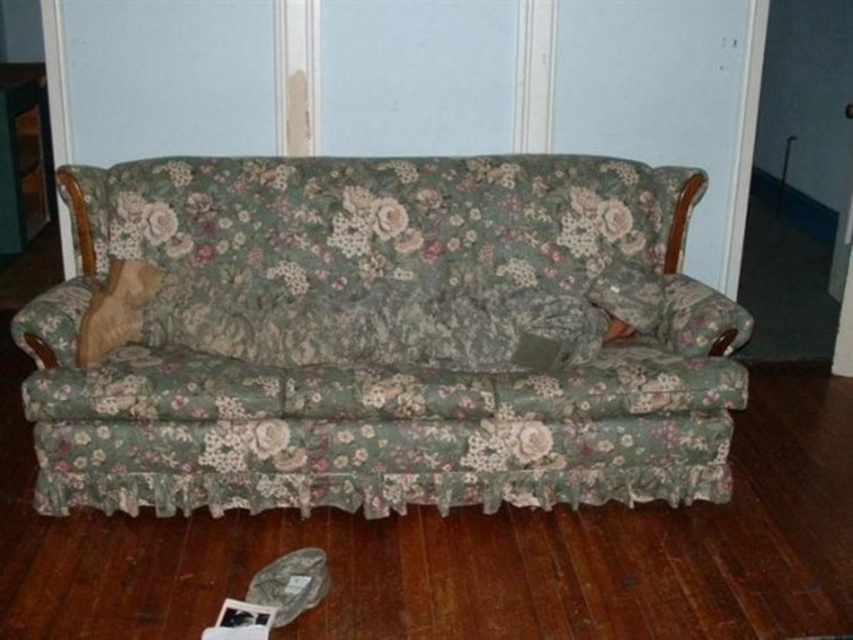
Does wooden pillow at left have a lesser height compared to floral fabric pillow at center?

No, wooden pillow at left is not shorter than floral fabric pillow at center.

Is wooden pillow at left positioned before floral fabric pillow at center?

That is True.

Image resolution: width=853 pixels, height=640 pixels. What are the coordinates of `wooden pillow at left` in the screenshot? It's located at (115, 308).

Find the location of a particular element. The image size is (853, 640). wooden pillow at left is located at coordinates (115, 308).

Between point (634, 445) and point (109, 348), which one is positioned in front?

Point (634, 445) is more forward.

You are a GUI agent. You are given a task and a screenshot of the screen. Output one action in this format:
    pyautogui.click(x=<x>, y=<y>)
    Task: Click on the floral fabric couch at center
    The width and height of the screenshot is (853, 640).
    Given the screenshot: What is the action you would take?
    pyautogui.click(x=380, y=340)

Is floral fabric couch at center smaller than floral fabric pillow at center?

Incorrect, floral fabric couch at center is not smaller in size than floral fabric pillow at center.

Between point (606, 428) and point (630, 266), which one is positioned behind?

The point (630, 266) is behind.

Is point (325, 488) closer to viewer compared to point (656, 308)?

Yes, point (325, 488) is in front of point (656, 308).

Locate an element on the screen. Image resolution: width=853 pixels, height=640 pixels. floral fabric couch at center is located at coordinates (380, 340).